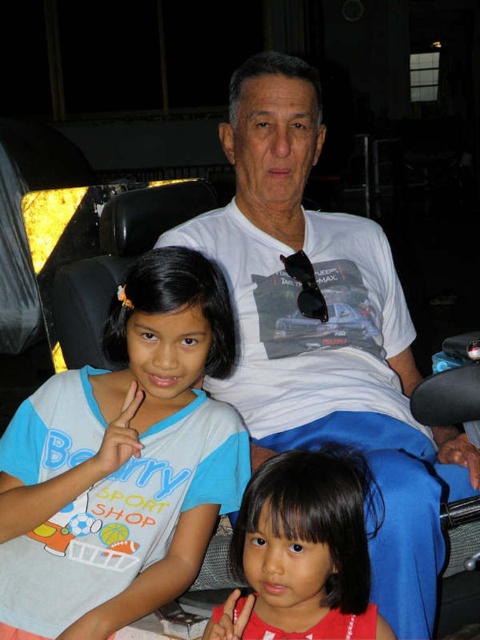
Question: Which point is farther from the camera taking this photo?

Choices:
 (A) (154, 529)
 (B) (414, 618)
 (C) (338, 584)

Answer: (A)

Question: From the image, what is the correct spatial relationship of blue cotton shirt at left in relation to smooth red shirt at lower center?

Choices:
 (A) right
 (B) left

Answer: (B)

Question: Is white cotton t-shirt at center positioned before blue cotton shirt at left?

Choices:
 (A) yes
 (B) no

Answer: (B)

Question: Which point is closer to the camera?

Choices:
 (A) (105, 540)
 (B) (471, 449)

Answer: (A)

Question: Which object is the farthest from the smooth red shirt at lower center?

Choices:
 (A) white cotton t-shirt at center
 (B) blue cotton shirt at left

Answer: (A)

Question: Does white cotton t-shirt at center have a smaller size compared to smooth red shirt at lower center?

Choices:
 (A) no
 (B) yes

Answer: (A)